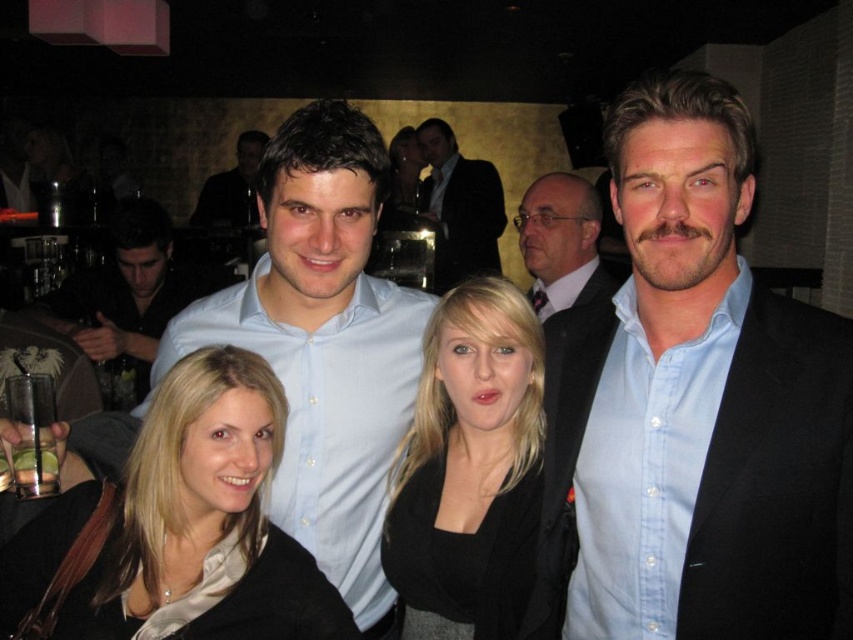
Question: From the image, what is the correct spatial relationship of matte white shirt at center in relation to light blue shirt at center?

Choices:
 (A) below
 (B) above

Answer: (A)

Question: Is matte black jacket at lower left further to camera compared to matte black suit at upper center?

Choices:
 (A) no
 (B) yes

Answer: (A)

Question: Estimate the real-world distances between objects in this image. Which object is farther from the light blue shirt at center?

Choices:
 (A) matte white shirt at center
 (B) dark suit at center
 (C) matte light blue shirt at center
 (D) blue shirt at center

Answer: (D)

Question: Does blue shirt at center appear over light blue shirt at center?

Choices:
 (A) no
 (B) yes

Answer: (A)

Question: Which point is closer to the camera?

Choices:
 (A) light blue shirt at center
 (B) matte white shirt at center
 (C) matte black suit at upper center

Answer: (B)

Question: Among these points, which one is nearest to the camera?

Choices:
 (A) (517, 227)
 (B) (450, 211)
 (C) (653, 296)

Answer: (C)